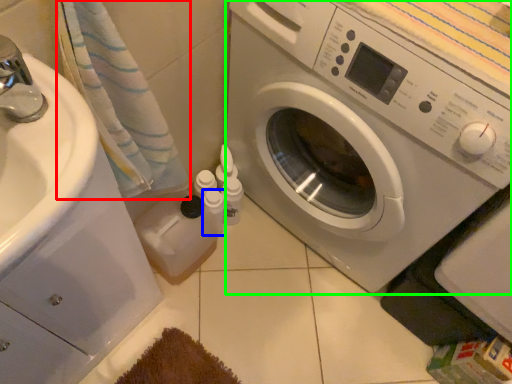
Question: Considering the real-world distances, which object is closest to bath towel (highlighted by a red box)? toiletry (highlighted by a blue box) or washing machine (highlighted by a green box).

Choices:
 (A) toiletry
 (B) washing machine

Answer: (B)